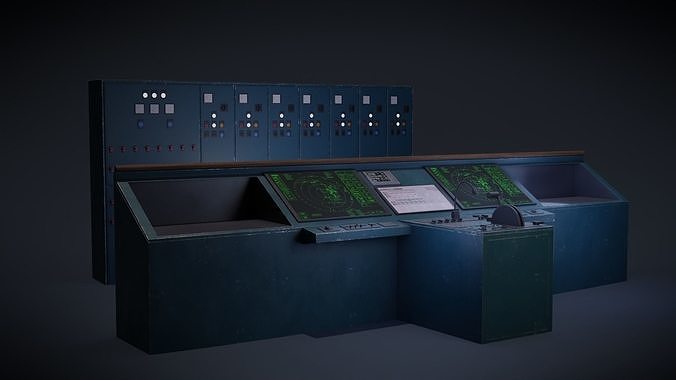
The height and width of the screenshot is (380, 676). In order to click on floor in this screenshot , I will do `click(354, 345)`.